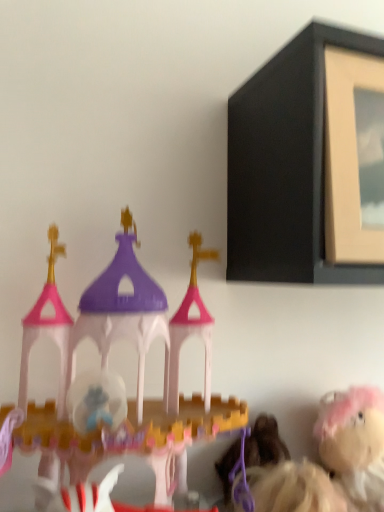
Find the location of `free point above fluffy pink plush at lower right, the first toy viewed from the right (from a real-world perspective)`. free point above fluffy pink plush at lower right, the first toy viewed from the right (from a real-world perspective) is located at coordinates (357, 403).